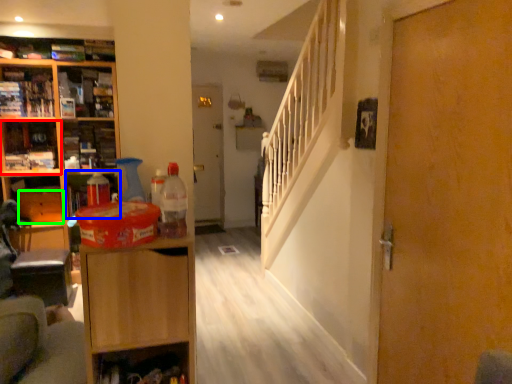
Question: Which object is positioned farthest from cabinet (highlighted by a red box)? Select from cabinet (highlighted by a blue box) and drawer (highlighted by a green box).

Choices:
 (A) cabinet
 (B) drawer

Answer: (A)